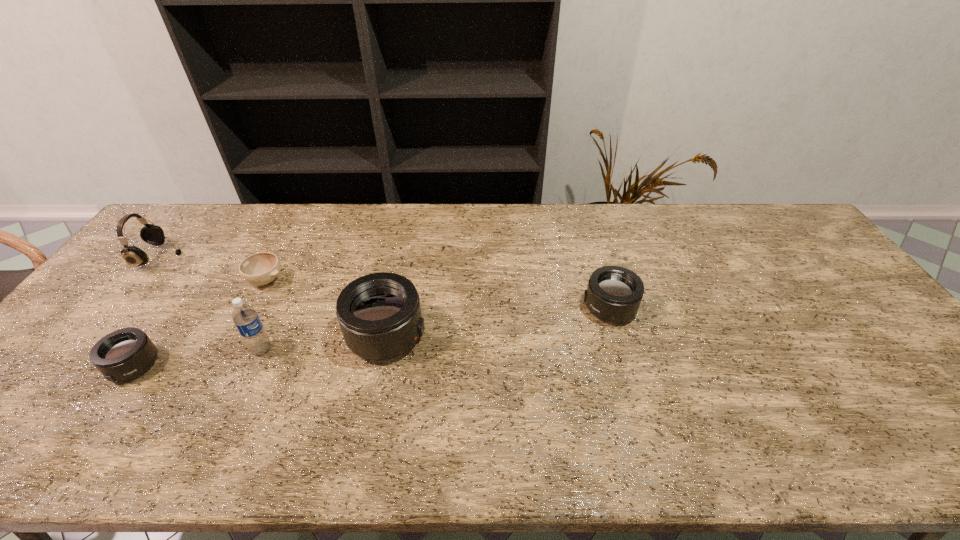
The height and width of the screenshot is (540, 960). In order to click on free spot between the bowl and the second shortest telephoto lens in this screenshot , I will do `click(438, 294)`.

You are a GUI agent. You are given a task and a screenshot of the screen. Output one action in this format:
    pyautogui.click(x=<x>, y=<y>)
    Task: Click on the free space that is in between the water bottle and the rightmost object
    This screenshot has width=960, height=540.
    Given the screenshot: What is the action you would take?
    pyautogui.click(x=436, y=329)

Where is `free space between the leftmost object and the tallest telephoto lens`? This screenshot has height=540, width=960. free space between the leftmost object and the tallest telephoto lens is located at coordinates (274, 296).

Where is `vacant space that's between the headset and the leftmost telephoto lens`? vacant space that's between the headset and the leftmost telephoto lens is located at coordinates (147, 311).

Find the location of a particular element. The width and height of the screenshot is (960, 540). object that is the third closest to the second shortest telephoto lens is located at coordinates (261, 268).

Locate an element on the screen. The image size is (960, 540). object that can be found as the second closest to the tallest telephoto lens is located at coordinates (261, 268).

Locate an element on the screen. This screenshot has height=540, width=960. the closest telephoto lens to the tallest object is located at coordinates (379, 314).

What are the coordinates of `the third closest telephoto lens to the headset` in the screenshot? It's located at (614, 293).

Locate an element on the screen. free space in the image that satisfies the following two spatial constraints: 1. with the microphone on the side of the water bottle; 2. on the left side of the headset is located at coordinates (84, 349).

Identify the location of vacant region that satisfies the following two spatial constraints: 1. on the side of the fourth tallest object with brand markings and control switches; 2. on the side of the leftmost telephoto lens with brand markings and control switches. (626, 366).